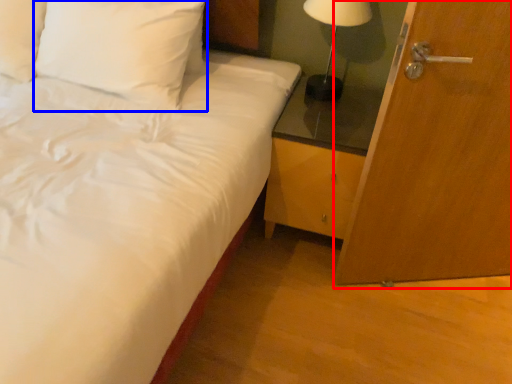
Question: Among these objects, which one is farthest to the camera, door (highlighted by a red box) or pillow (highlighted by a blue box)?

Choices:
 (A) door
 (B) pillow

Answer: (B)